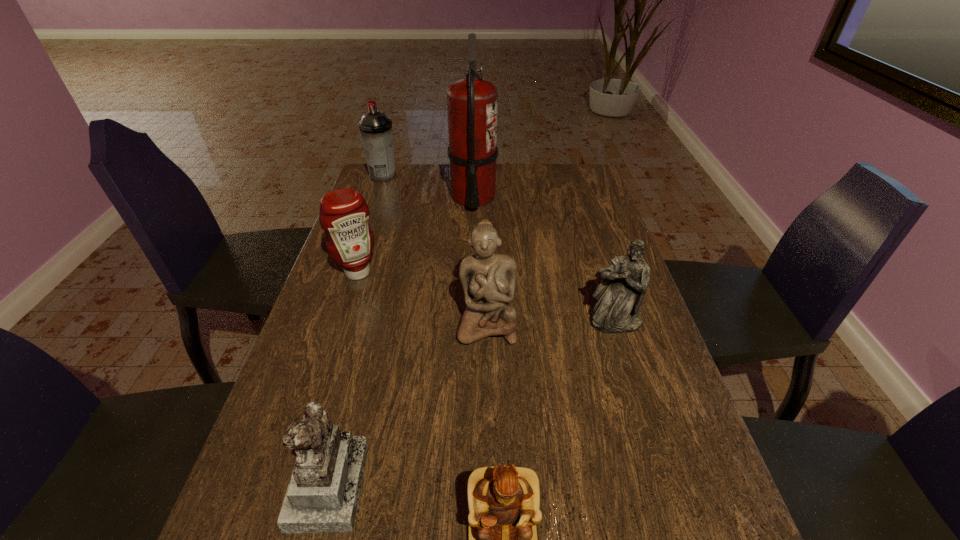
In the image, there is a desktop. Where is `vacant space at the far left corner`? vacant space at the far left corner is located at coordinates (412, 172).

The width and height of the screenshot is (960, 540). Identify the location of free space that is in between the tallest object and the rightmost object. (544, 259).

Identify the location of unoccupied position between the rightmost figurine and the aerosol can. The width and height of the screenshot is (960, 540). (499, 249).

Identify the location of vacant space in between the tallest object and the rightmost figurine. Image resolution: width=960 pixels, height=540 pixels. (544, 259).

The height and width of the screenshot is (540, 960). In order to click on unoccupied position between the leftmost figurine and the condiment in this screenshot , I will do `click(344, 378)`.

Where is `object that is the fourth nearest to the tallest object`? object that is the fourth nearest to the tallest object is located at coordinates (620, 293).

Locate an element on the screen. object that can be found as the fourth closest to the tallest object is located at coordinates [x=620, y=293].

Locate an element on the screen. Image resolution: width=960 pixels, height=540 pixels. figurine that is the second closest to the leftmost figurine is located at coordinates (488, 280).

This screenshot has width=960, height=540. Identify the location of figurine that is the second nearest to the rightmost object. (503, 502).